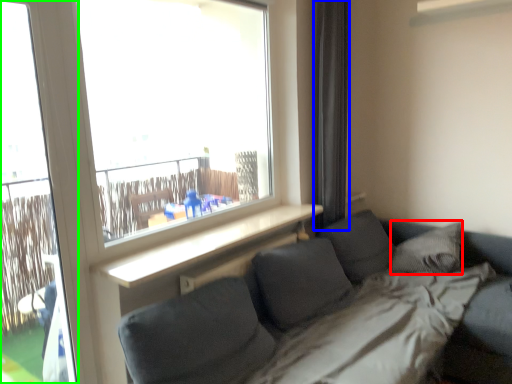
Question: Based on their relative distances, which object is nearer to pillow (highlighted by a red box)? Choose from curtain (highlighted by a blue box) and screen door (highlighted by a green box).

Choices:
 (A) curtain
 (B) screen door

Answer: (A)